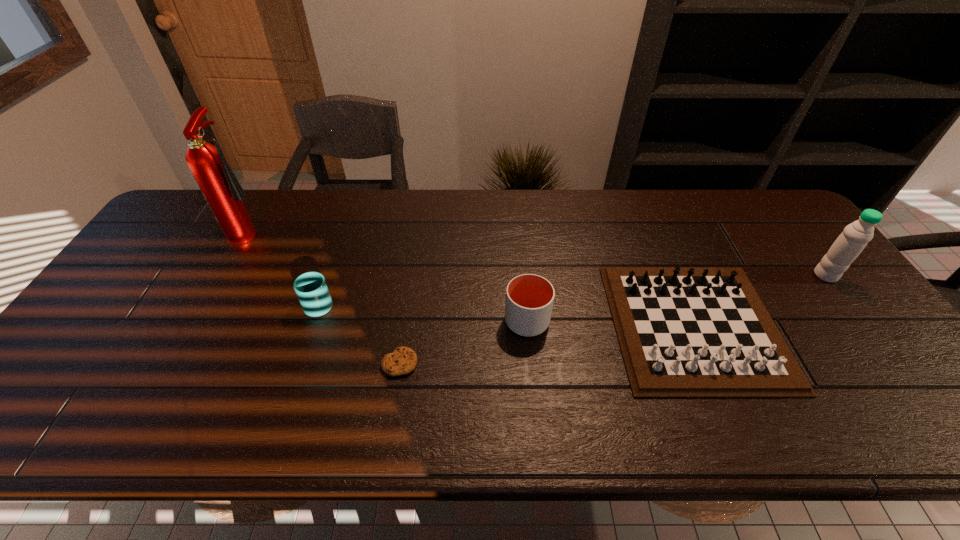
Where is `the fourth object from right to left`? Image resolution: width=960 pixels, height=540 pixels. the fourth object from right to left is located at coordinates coord(403,360).

You are a GUI agent. You are given a task and a screenshot of the screen. Output one action in this format:
    pyautogui.click(x=<x>, y=<y>)
    Task: Click on the shortest object
    The width and height of the screenshot is (960, 540).
    Given the screenshot: What is the action you would take?
    pyautogui.click(x=403, y=360)

Image resolution: width=960 pixels, height=540 pixels. What are the coordinates of `vacant space positioned at the nozzle of the tallest object` in the screenshot? It's located at (375, 231).

The width and height of the screenshot is (960, 540). I want to click on blank space located 0.100m on the front of the second tallest object, so click(x=852, y=312).

The image size is (960, 540). Identify the location of free location located on the back of the right cup. point(521,255).

Identify the location of vacant area located on the handle side of the shorter cup. (337, 250).

In order to click on blank space located on the handle side of the shorter cup in this screenshot , I will do `click(332, 266)`.

At what (x,y) coordinates should I click in order to perform the action: click on free region located 0.280m on the handle side of the shorter cup. Please return your answer as a coordinate pair (x, y). Looking at the image, I should click on (346, 224).

Where is `vacant space located on the front of the gameboard`? vacant space located on the front of the gameboard is located at coordinates (737, 428).

Locate an element on the screen. The image size is (960, 540). free space located 0.050m on the front of the shortest object is located at coordinates (395, 398).